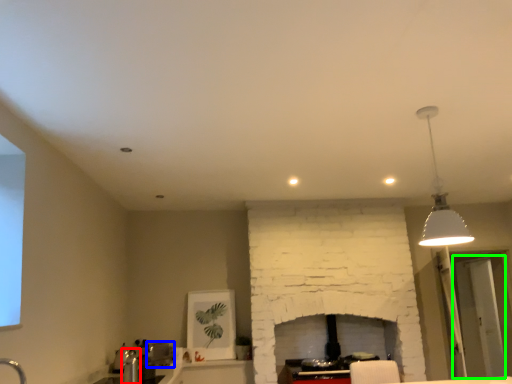
Question: Estimate the real-world distances between objects in this image. Which object is closer to faucet (highlighted by a red box), appliance (highlighted by a blue box) or glass door (highlighted by a green box)?

Choices:
 (A) appliance
 (B) glass door

Answer: (A)